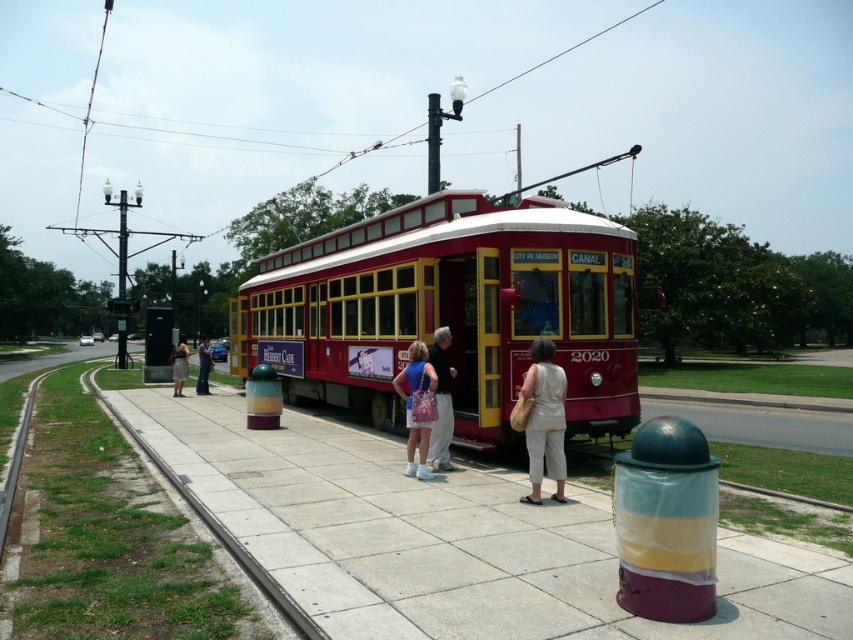
Can you confirm if shiny red trolley at center is shorter than beige cotton pants at center?

In fact, shiny red trolley at center may be taller than beige cotton pants at center.

Is point (486, 292) positioned behind point (552, 461)?

Yes, it is.

Which is behind, point (531, 262) or point (538, 412)?

The point (531, 262) is behind.

I want to click on shiny red trolley at center, so click(x=450, y=308).

In the scene shown: Does shiny red trolley at center have a larger size compared to light beige cotton dress at center?

Yes, shiny red trolley at center is bigger than light beige cotton dress at center.

Between point (486, 241) and point (447, 468), which one is positioned in front?

Point (447, 468)

Which is behind, point (383, 396) or point (433, 436)?

The point (383, 396) is more distant.

You are a GUI agent. You are given a task and a screenshot of the screen. Output one action in this format:
    pyautogui.click(x=<x>, y=<y>)
    Task: Click on the shiny red trolley at center
    The image size is (853, 640).
    Given the screenshot: What is the action you would take?
    pyautogui.click(x=450, y=308)

Between smooth concrete pavement at center and light beige cotton dress at center, which one is positioned higher?

light beige cotton dress at center is higher up.

Measure the distance between smooth concrete pavement at center and light beige cotton dress at center.

1.73 meters

Image resolution: width=853 pixels, height=640 pixels. I want to click on smooth concrete pavement at center, so click(x=450, y=538).